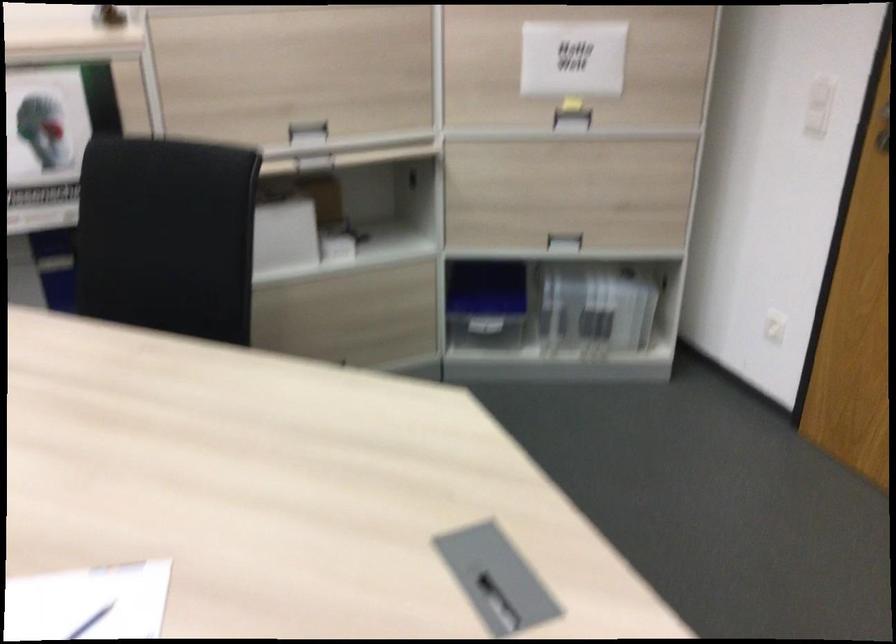
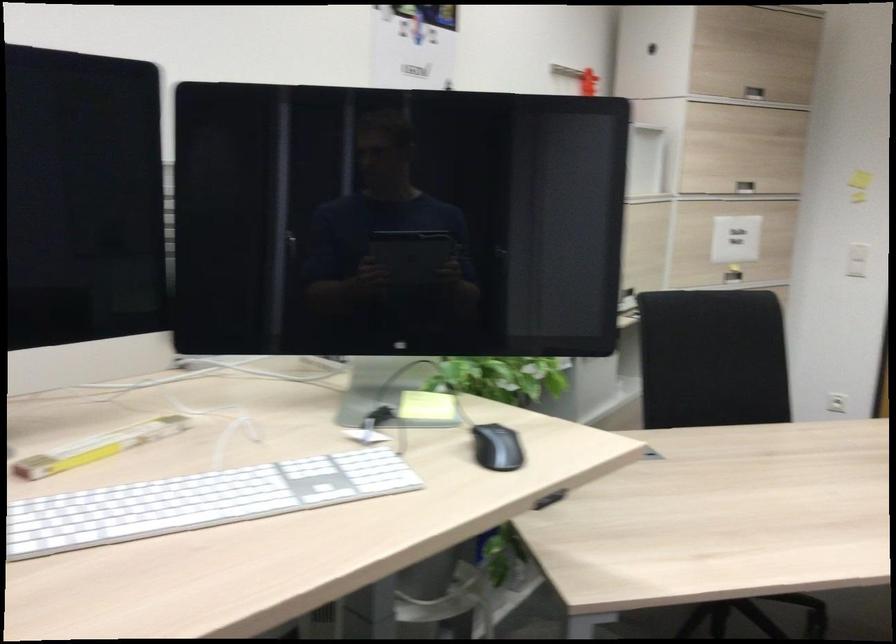
The point at (762, 105) is marked in the first image. Where is the corresponding point in the second image?

(857, 260)